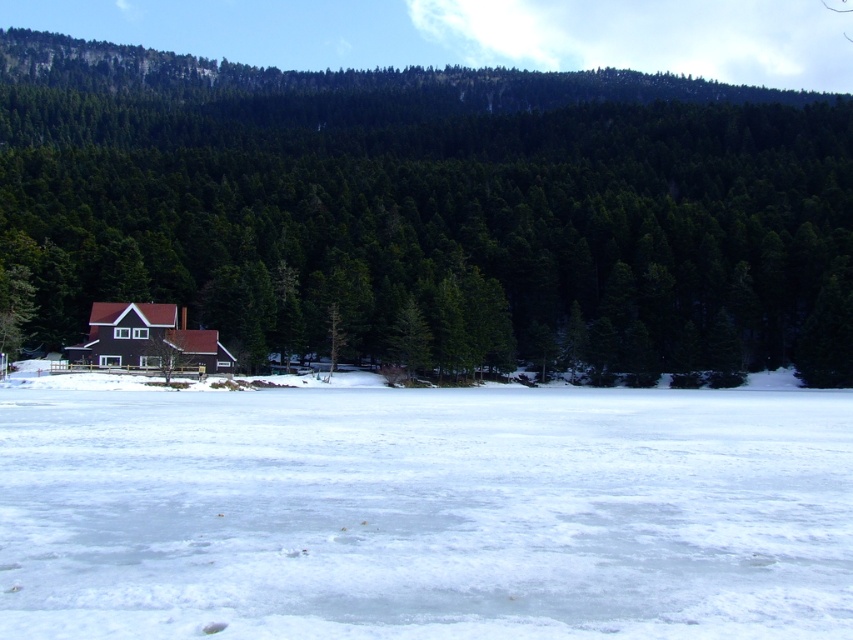
Question: Observing the image, what is the correct spatial positioning of white matte snow at center in reference to brown matte cabin at center?

Choices:
 (A) right
 (B) left

Answer: (A)

Question: Which object is the closest to the green matte tree at center?

Choices:
 (A) white matte snow at center
 (B) brown matte cabin at center

Answer: (B)

Question: Which object is positioned farthest from the brown matte cabin at center?

Choices:
 (A) white matte snow at center
 (B) green matte tree at center

Answer: (B)

Question: Which object is positioned closest to the white matte snow at center?

Choices:
 (A) brown matte cabin at center
 (B) green matte tree at center

Answer: (A)

Question: In this image, where is green matte tree at center located relative to white matte snow at center?

Choices:
 (A) above
 (B) below

Answer: (A)

Question: Is green matte tree at center above brown matte cabin at center?

Choices:
 (A) no
 (B) yes

Answer: (B)